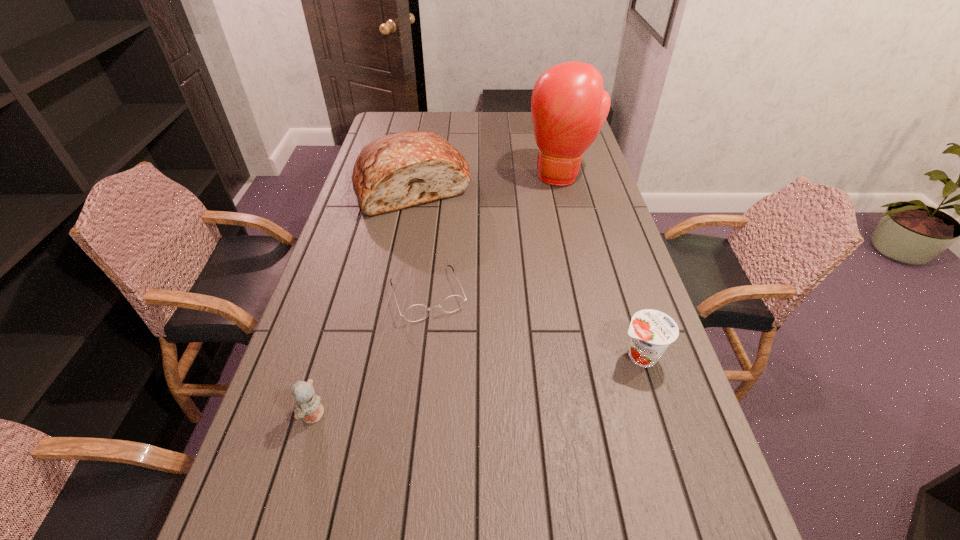
Where is `the nearest object`? the nearest object is located at coordinates (309, 408).

Locate an element on the screen. yogurt is located at coordinates (651, 331).

You are a GUI agent. You are given a task and a screenshot of the screen. Output one action in this format:
    pyautogui.click(x=<x>, y=<y>)
    Task: Click on the spectacles
    This screenshot has height=540, width=960.
    Given the screenshot: What is the action you would take?
    [417, 312]

Locate an element on the screen. Image resolution: width=960 pixels, height=540 pixels. the third nearest object is located at coordinates (417, 312).

Identify the location of the second tallest object. This screenshot has width=960, height=540. (395, 171).

Where is `boxing glove`? boxing glove is located at coordinates (569, 106).

I want to click on free space located 0.080m on the left of the yogurt, so click(583, 356).

Identify the location of blank space located 0.210m on the front-facing side of the spectacles. (463, 389).

Identify the location of free location located on the front-facing side of the spectacles. This screenshot has width=960, height=540. (458, 376).

Find the location of `vacant position located on the front-facing side of the spectacles`. vacant position located on the front-facing side of the spectacles is located at coordinates (459, 379).